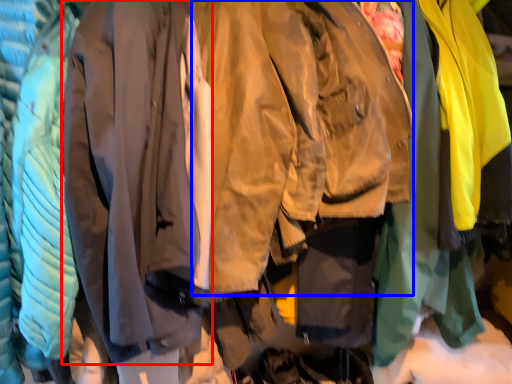
Question: Which object appears farthest to the camera in this image, sweatshirt (highlighted by a red box) or sweatshirt (highlighted by a blue box)?

Choices:
 (A) sweatshirt
 (B) sweatshirt

Answer: (B)